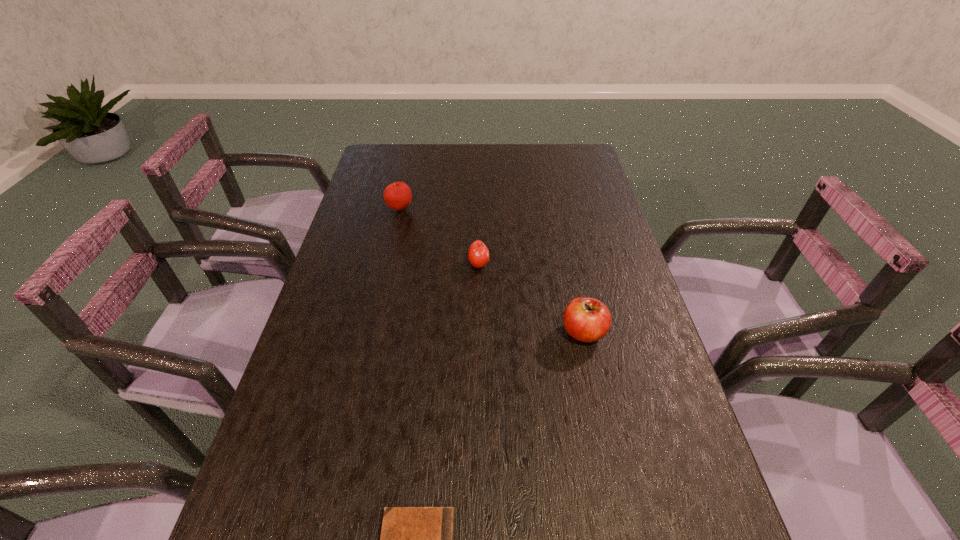
Locate an element on the screen. This screenshot has height=540, width=960. the nearest apple is located at coordinates [586, 319].

Where is `the second nearest object`? The height and width of the screenshot is (540, 960). the second nearest object is located at coordinates (586, 319).

This screenshot has height=540, width=960. I want to click on the farthest object, so click(397, 196).

This screenshot has height=540, width=960. Identify the location of the farthest apple. (397, 196).

What are the coordinates of `the second object from right to left` in the screenshot? It's located at (478, 254).

Locate an element on the screen. The width and height of the screenshot is (960, 540). the second shortest object is located at coordinates (478, 254).

This screenshot has width=960, height=540. What are the coordinates of `free spot located 0.370m on the back of the rightmost apple` in the screenshot? It's located at (561, 226).

What are the coordinates of `free space located on the back of the farthest object` in the screenshot? It's located at (411, 160).

Locate an element on the screen. blank space located 0.170m on the front of the third object from left to right is located at coordinates (479, 321).

You are a GUI agent. You are given a task and a screenshot of the screen. Output one action in this format:
    pyautogui.click(x=<x>, y=<y>)
    Task: Click on the object that is at the left edge
    This screenshot has width=960, height=540.
    Given the screenshot: What is the action you would take?
    pyautogui.click(x=397, y=196)